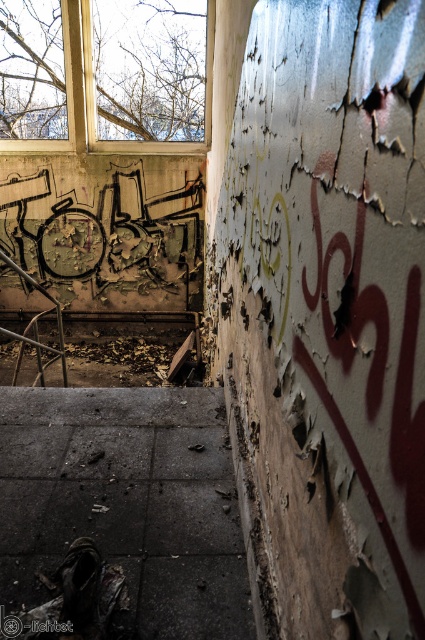
Consider the image. Is dark concrete stairs at center shorter than wooden frame window at upper left?

Indeed, dark concrete stairs at center has a lesser height compared to wooden frame window at upper left.

Is dark concrete stairs at center in front of wooden frame window at upper left?

Yes, dark concrete stairs at center is in front of wooden frame window at upper left.

Which is in front, point (223, 470) or point (45, 88)?

Point (223, 470)

Where is `dark concrete stairs at center`? The height and width of the screenshot is (640, 425). dark concrete stairs at center is located at coordinates (125, 502).

Looking at this image, who is lower down, wooden frame window at upper left or rusty metal staircase at lower left?

rusty metal staircase at lower left is lower down.

Who is shorter, wooden frame window at upper left or rusty metal staircase at lower left?

rusty metal staircase at lower left is shorter.

Where is `wooden frame window at upper left`? wooden frame window at upper left is located at coordinates (104, 74).

Image resolution: width=425 pixels, height=640 pixels. What are the coordinates of `wooden frame window at upper left` in the screenshot? It's located at (104, 74).

This screenshot has width=425, height=640. Find the location of `dark concrete stairs at center`. dark concrete stairs at center is located at coordinates (125, 502).

Is dark concrete stairs at center bigger than rusty metal staircase at lower left?

No, dark concrete stairs at center is not bigger than rusty metal staircase at lower left.

Does point (223, 435) lie in front of point (20, 323)?

Yes, point (223, 435) is in front of point (20, 323).

This screenshot has height=640, width=425. I want to click on dark concrete stairs at center, so click(x=125, y=502).